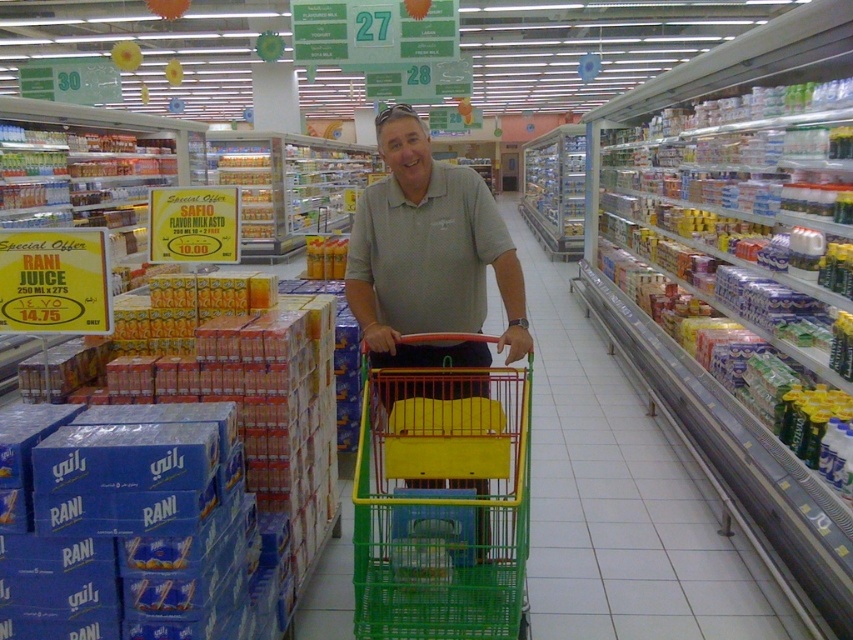
You are a customer in the grocery store and want to pick up the matte gray shirt at center. You have a green plastic trolley at center in your way. Can you reach the shirt without moving the trolley?

The green plastic trolley at center is closer to the viewer than the matte gray shirt at center, so the trolley is blocking the path to the shirt. You need to move the trolley to reach the shirt.

You are a customer in the grocery store and you want to grab the matte gray shirt at center while pushing the green plastic trolley at center. Can you do both at the same time without letting go of either?

The green plastic trolley at center is located below the matte gray shirt at center, so you can push the green plastic trolley at center while reaching up to grab the matte gray shirt at center without letting go of either.